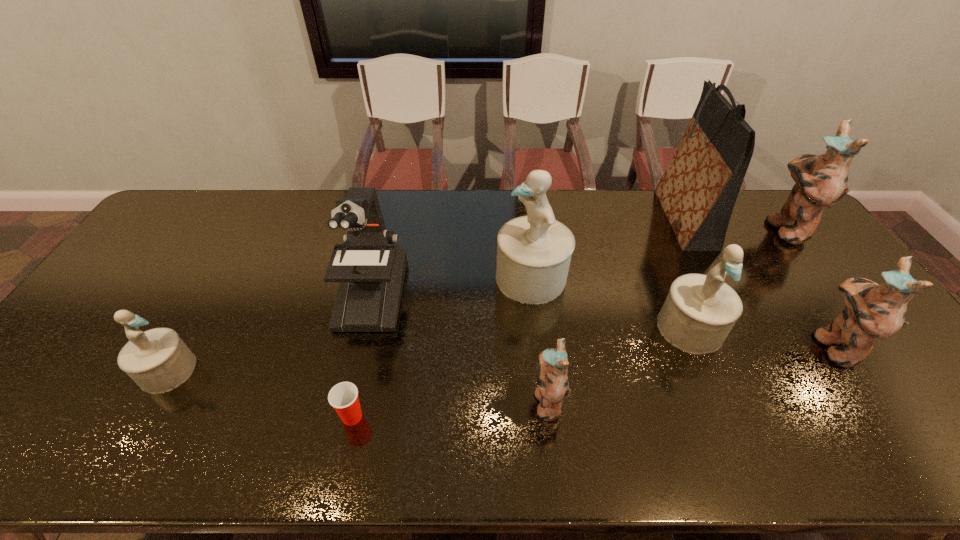
The width and height of the screenshot is (960, 540). Identify the location of vacant space located on the front-facing side of the leftmost pink figurine. (414, 401).

The height and width of the screenshot is (540, 960). I want to click on free space located 0.290m on the front-facing side of the leftmost pink figurine, so click(x=410, y=401).

Where is `free spot located on the right of the red Dixie cup`? This screenshot has width=960, height=540. free spot located on the right of the red Dixie cup is located at coordinates (488, 416).

Locate an element on the screen. shopping bag that is at the far edge is located at coordinates (698, 191).

This screenshot has height=540, width=960. Identify the location of figurine situated at the far edge. (821, 181).

Locate an element on the screen. The height and width of the screenshot is (540, 960). object that is at the near edge is located at coordinates (343, 397).

I want to click on object that is positioned at the far right corner, so click(821, 181).

Locate an element on the screen. This screenshot has width=960, height=540. free space at the far edge is located at coordinates (384, 190).

Where is `vacant space at the near edge of the desktop`? vacant space at the near edge of the desktop is located at coordinates (535, 463).

Where is `vacant area at the left edge of the desktop`? The image size is (960, 540). vacant area at the left edge of the desktop is located at coordinates (119, 344).